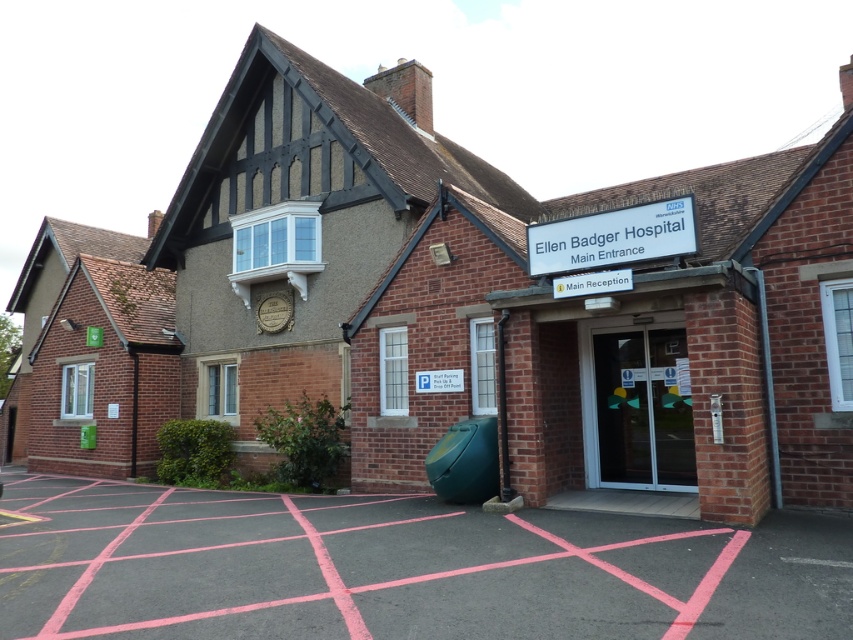
Does pink asphalt parking lot at lower center have a smaller size compared to transparent glass doors at center?

Incorrect, pink asphalt parking lot at lower center is not smaller in size than transparent glass doors at center.

Based on the photo, is pink asphalt parking lot at lower center thinner than transparent glass doors at center?

No, pink asphalt parking lot at lower center is not thinner than transparent glass doors at center.

You are a GUI agent. You are given a task and a screenshot of the screen. Output one action in this format:
    pyautogui.click(x=<x>, y=<y>)
    Task: Click on the pink asphalt parking lot at lower center
    The width and height of the screenshot is (853, 640).
    Given the screenshot: What is the action you would take?
    pyautogui.click(x=398, y=568)